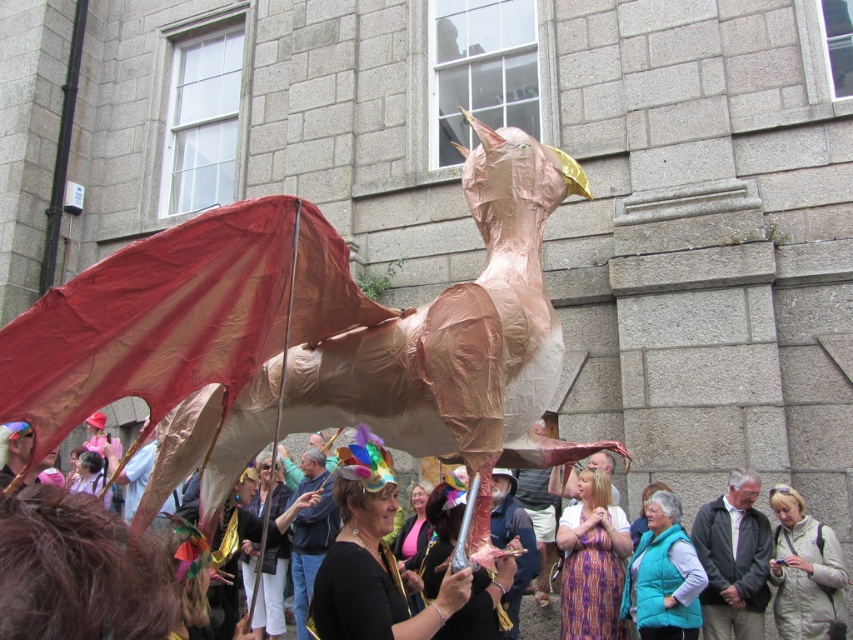
From the picture: You are organizing a costume party and need to decide which outfit to choose between the printed fabric dress at center and the teal puffer vest at center. Based on the image, which one is narrower?

The printed fabric dress at center has a lesser width compared to teal puffer vest at center, so the printed fabric dress at center is narrower.

You are standing in the crowd watching the bird puppet parade. There are two points marked on the puppet, one at coordinates point (564,579) and another at point (675,563). Which point is closer to you?

Point (564,579) is closer to you because it is further to the viewer than point (675,563).